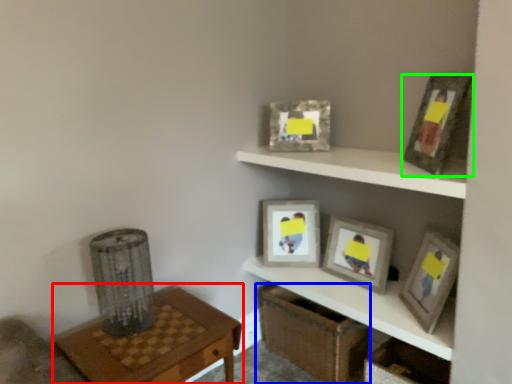
Question: Estimate the real-world distances between objects in this image. Which object is farther from table (highlighted by a red box), crate (highlighted by a blue box) or picture frame (highlighted by a green box)?

Choices:
 (A) crate
 (B) picture frame

Answer: (B)